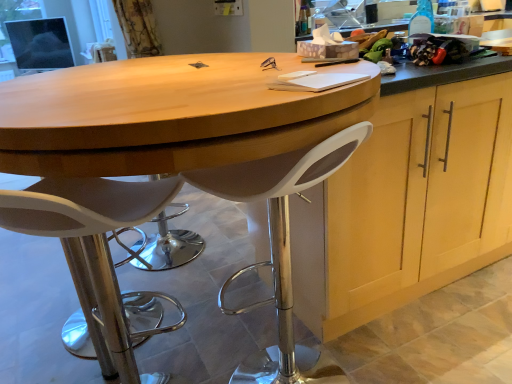
Where is `free region under wooden table at center (from a real-world perspective)`? free region under wooden table at center (from a real-world perspective) is located at coordinates (192, 315).